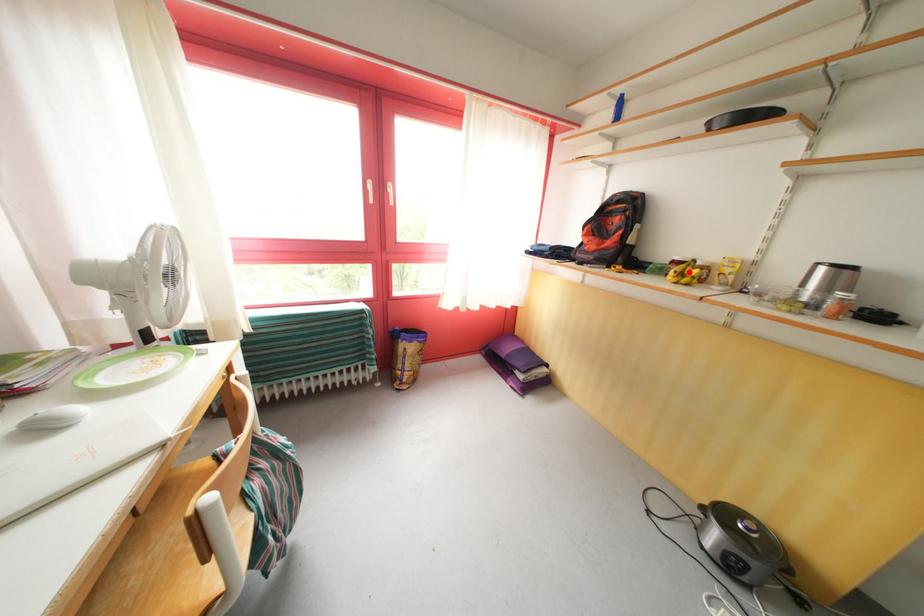
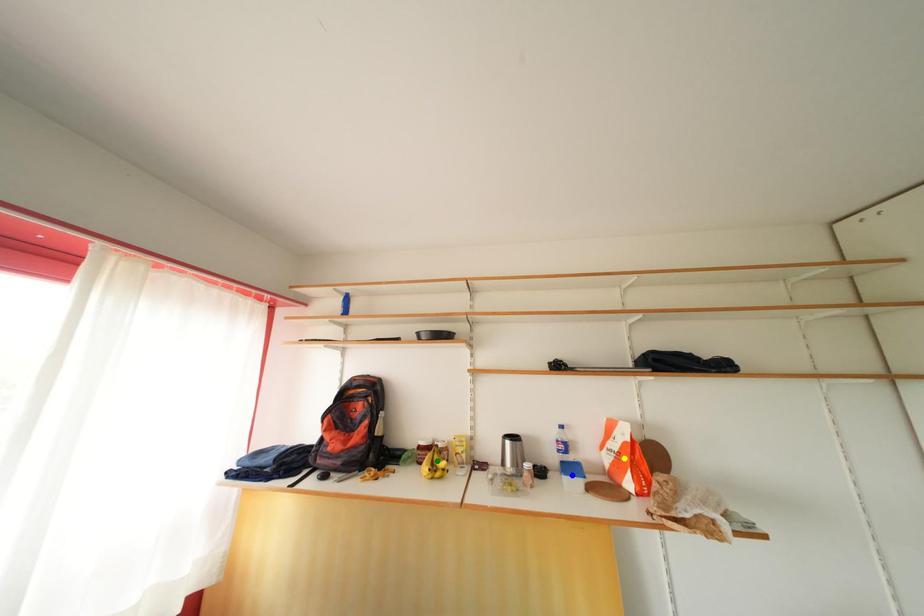
Question: I am providing you with two images of the same scene from different viewpoints. A red point is marked on the first image. You are given multiple points on the second image. In image 2, which mark is for the same physical point as the one in image 1?

Choices:
 (A) yellow point
 (B) green point
 (C) blue point

Answer: (B)